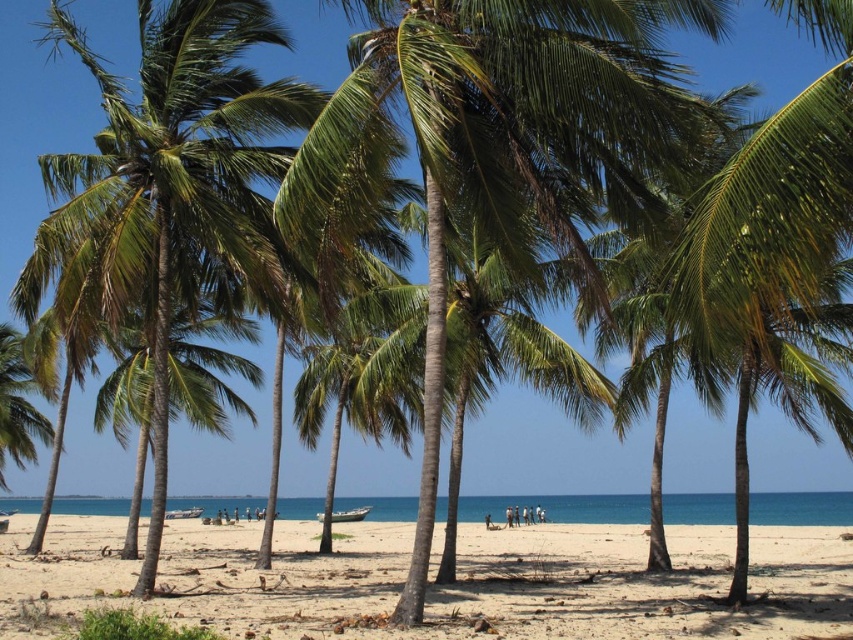
Who is more forward, (573,609) or (137,10)?

Point (573,609)

In the scene shown: Measure the distance between point (x=291, y=580) and camera.

They are 67.53 feet apart.

Find the location of a particular element. The image size is (853, 640). light beige sand at center is located at coordinates (445, 586).